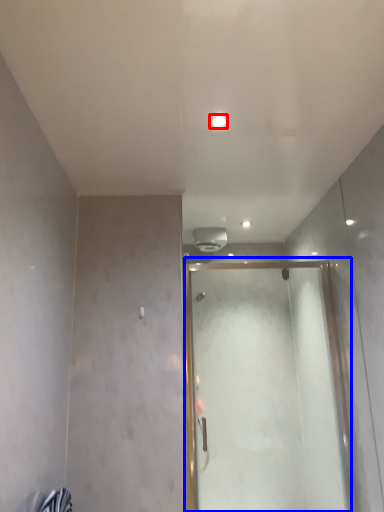
Question: Which object appears closest to the camera in this image, light (highlighted by a red box) or glass door (highlighted by a blue box)?

Choices:
 (A) light
 (B) glass door

Answer: (A)